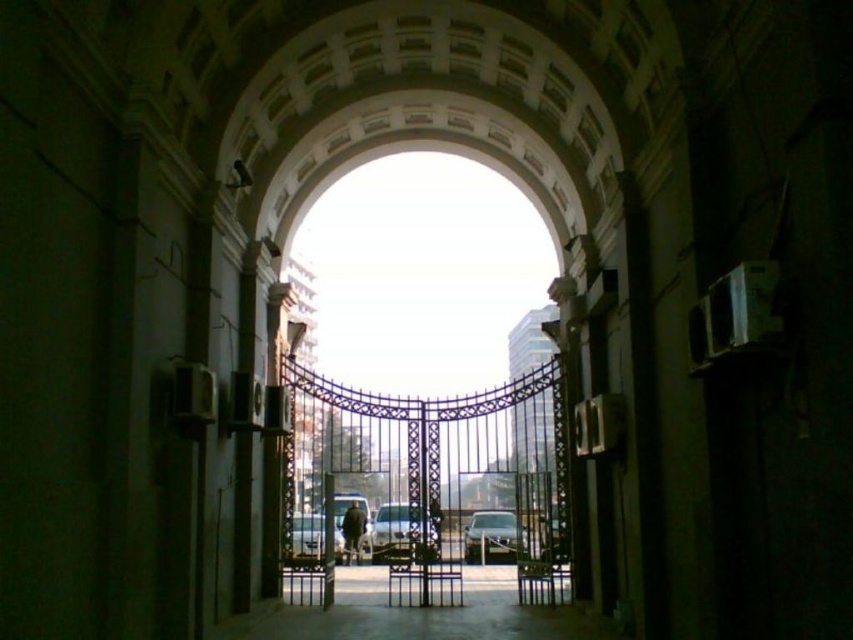
You are a photographer standing at the entrance of the archway. You want to capture a photo that includes both the silver metallic car at center and the dark fabric jacket at center. Which object will appear bigger in the photo?

The silver metallic car at center is larger in size than the dark fabric jacket at center, so it will appear bigger in the photo.

You are standing at the entrance of the city and see a point marked at coordinates (306, 534). What object is located at that point?

The point at coordinates (306, 534) indicates a silver metallic car at center.

You are a pedestrian standing in front of the grand archway. You see a silver metallic van at center and a silver metallic car at center. Which vehicle is blocking the other one from your view?

The silver metallic van at center is positioned over the silver metallic car at center, so the van is blocking the car from your view.